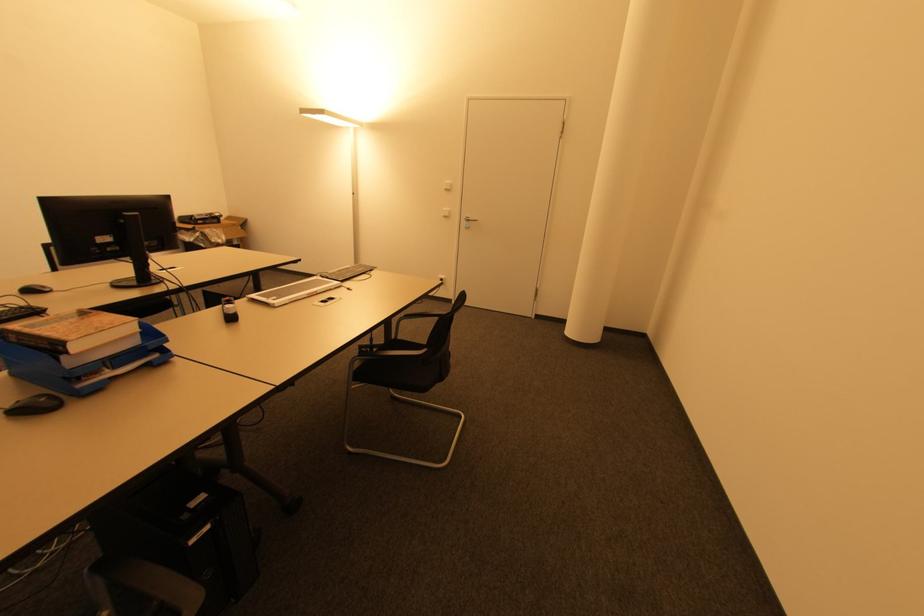
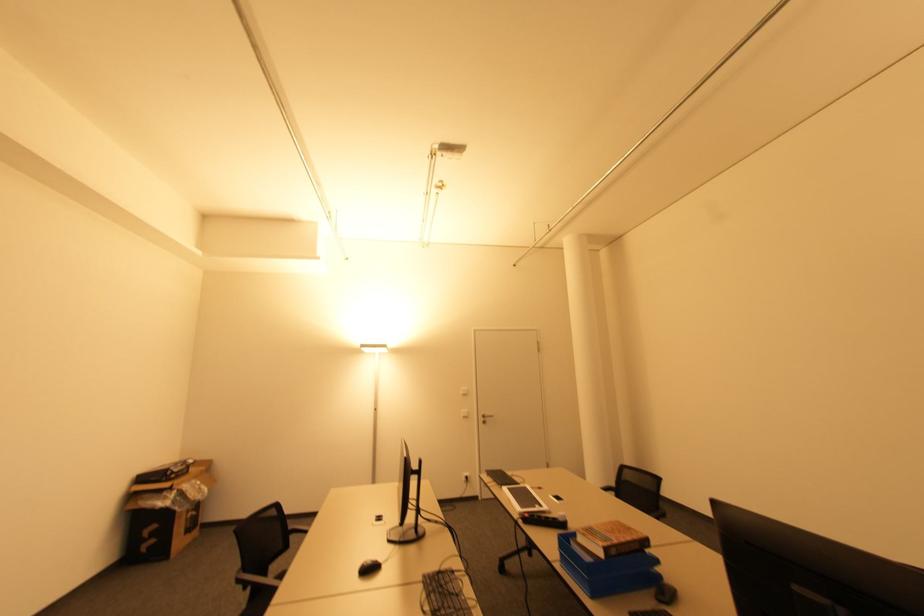
Locate, in the second image, the point that corresponds to the point at 451,188 in the first image.

(468, 392)